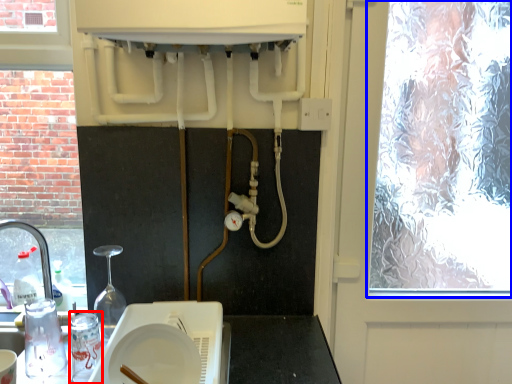
Question: Among these objects, which one is farthest to the camera, appliance (highlighted by a red box) or window (highlighted by a blue box)?

Choices:
 (A) appliance
 (B) window

Answer: (B)